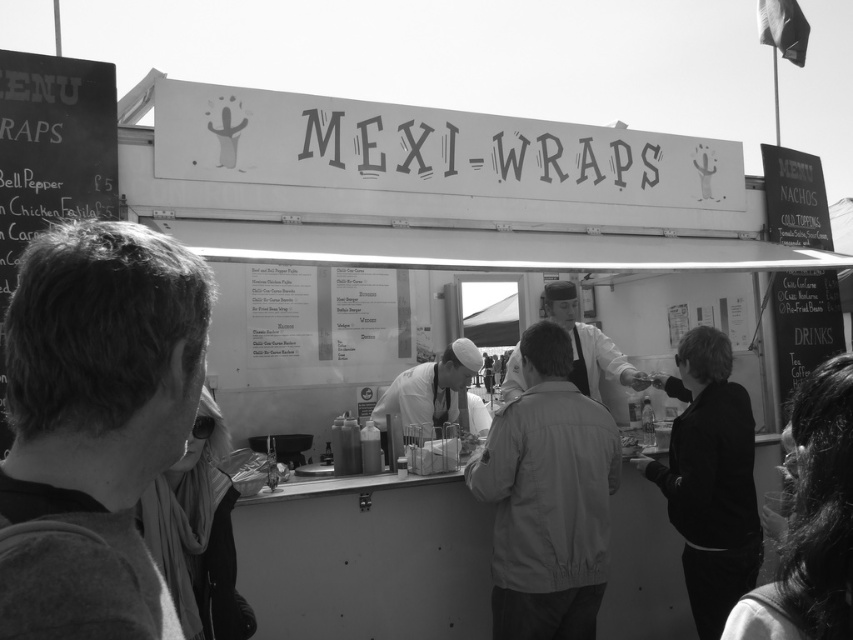
Is chalkboard menu at left thinner than sunglasses at lower left?

Incorrect, chalkboard menu at left's width is not less than sunglasses at lower left's.

Image resolution: width=853 pixels, height=640 pixels. What do you see at coordinates (50, 160) in the screenshot? I see `chalkboard menu at left` at bounding box center [50, 160].

Where is `chalkboard menu at left`? Image resolution: width=853 pixels, height=640 pixels. chalkboard menu at left is located at coordinates (50, 160).

Can you confirm if chalkboard menu at left is positioned above dark hair at lower right?

Indeed, chalkboard menu at left is positioned over dark hair at lower right.

Consider the image. Who is lower down, chalkboard menu at left or dark hair at lower right?

dark hair at lower right is lower down.

Does point (22, 221) come behind point (827, 388)?

Yes, point (22, 221) is behind point (827, 388).

Where is `chalkboard menu at left`? The image size is (853, 640). chalkboard menu at left is located at coordinates (50, 160).

From the picture: How much distance is there between smooth black shirt at lower left and sunglasses at lower left?

4.19 feet

Is smooth black shirt at lower left bigger than sunglasses at lower left?

No.

Image resolution: width=853 pixels, height=640 pixels. What do you see at coordinates (96, 420) in the screenshot? I see `smooth black shirt at lower left` at bounding box center [96, 420].

At what (x,y) coordinates should I click in order to perform the action: click on smooth black shirt at lower left. Please return your answer as a coordinate pair (x, y). The image size is (853, 640). Looking at the image, I should click on (96, 420).